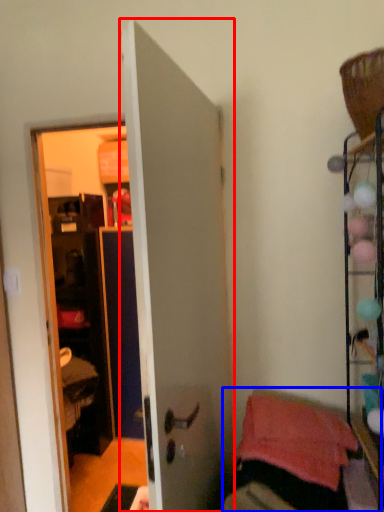
Question: Which object is closer to the camera taking this photo, door (highlighted by a red box) or furniture (highlighted by a blue box)?

Choices:
 (A) door
 (B) furniture

Answer: (A)